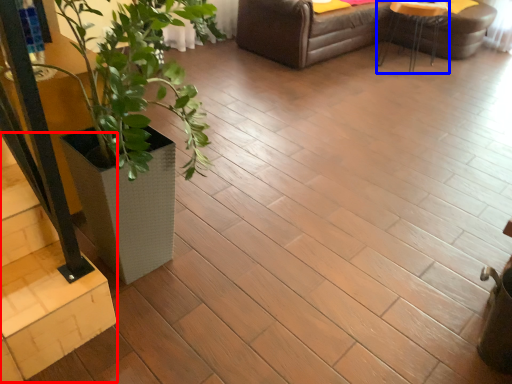
Question: Which of the following is the farthest to the observer, stairwell (highlighted by a red box) or table (highlighted by a blue box)?

Choices:
 (A) stairwell
 (B) table

Answer: (B)